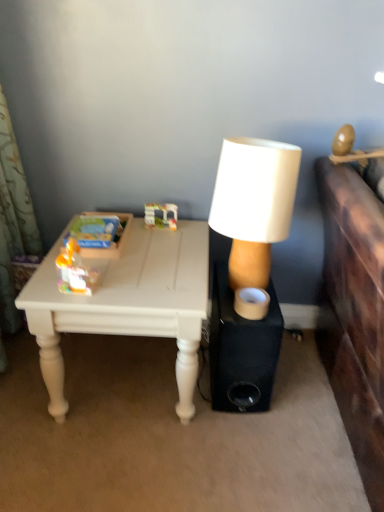
You are a GUI agent. You are given a task and a screenshot of the screen. Output one action in this format:
    pyautogui.click(x=<x>, y=<y>)
    Task: Click on the free region on the left part of matte plastic toy at left, marked as the 2th toy in a top-to-bottom arrangement
    The image size is (384, 512).
    Given the screenshot: What is the action you would take?
    pyautogui.click(x=42, y=284)